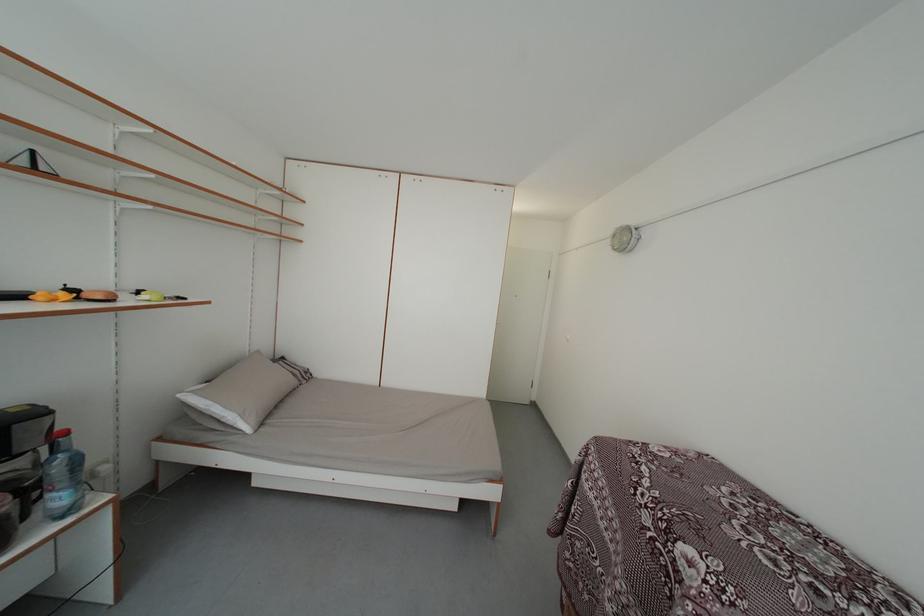
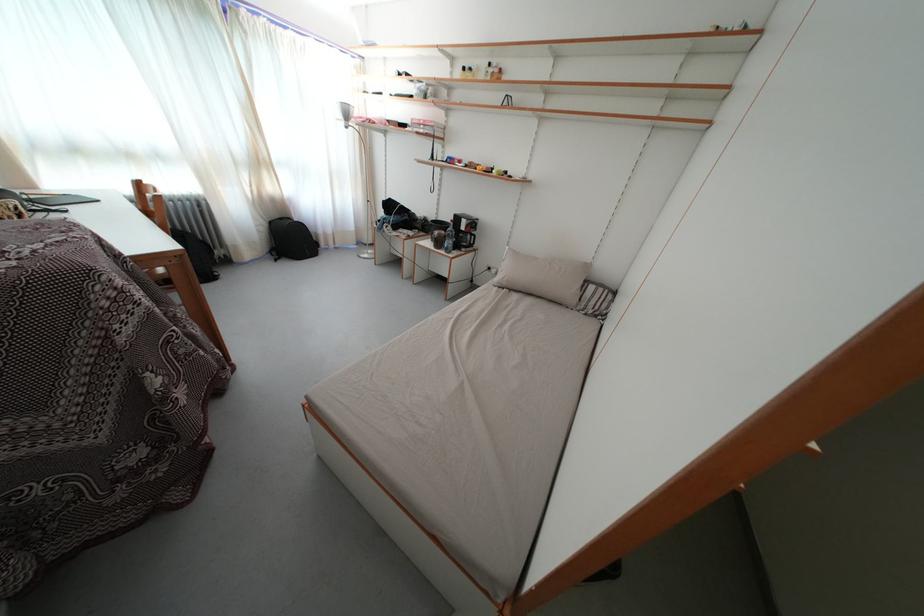
Find the pixel in the second image that matches the point at 112,474 in the first image.

(500, 276)